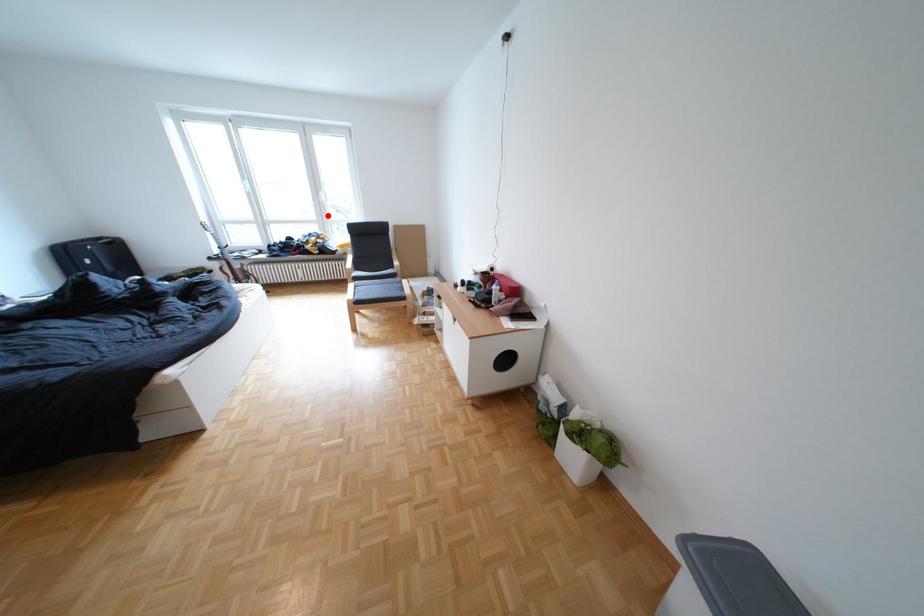
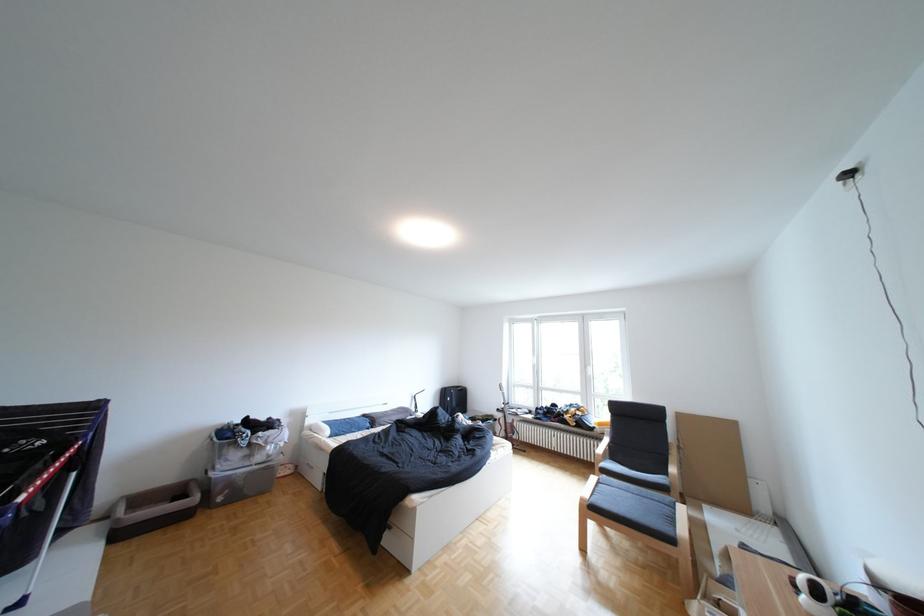
Find the pixel in the second image that matches the highlighted location in the first image.

(592, 387)